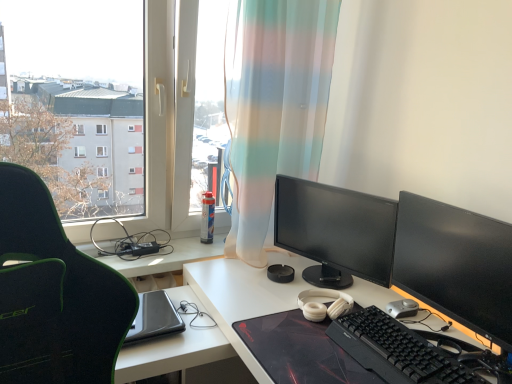
Identify the location of vacant space situated on the left part of silver metallic mouse at lower right. This screenshot has height=384, width=512. (356, 299).